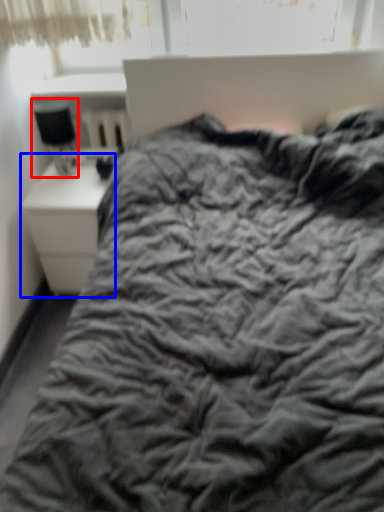
Question: Which object is closer to the camera taking this photo, table lamp (highlighted by a red box) or nightstand (highlighted by a blue box)?

Choices:
 (A) table lamp
 (B) nightstand

Answer: (A)